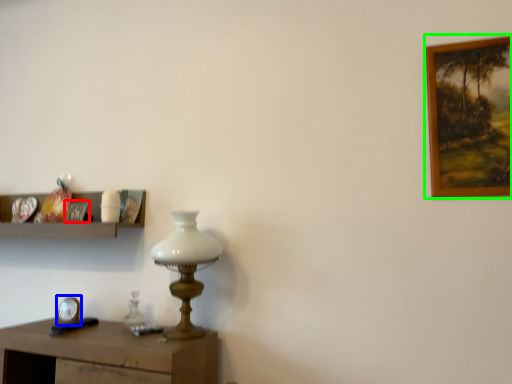
Question: Estimate the real-world distances between objects in this image. Which object is farther from picture frame (highlighted by a red box), clock (highlighted by a blue box) or picture frame (highlighted by a green box)?

Choices:
 (A) clock
 (B) picture frame

Answer: (B)